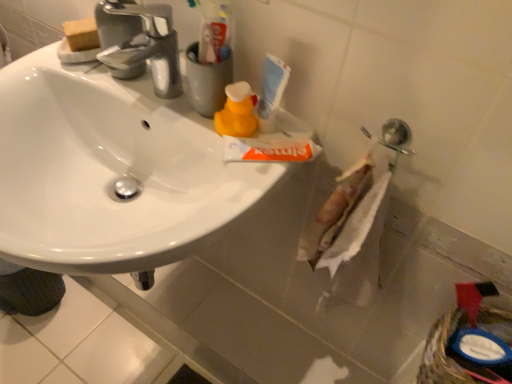
Question: Does blue plastic basket at lower right touch yellow matte bottle at center?

Choices:
 (A) yes
 (B) no

Answer: (B)

Question: Does blue plastic basket at lower right have a greater height compared to yellow matte bottle at center?

Choices:
 (A) no
 (B) yes

Answer: (B)

Question: From a real-world perspective, does blue plastic basket at lower right stand above yellow matte bottle at center?

Choices:
 (A) no
 (B) yes

Answer: (A)

Question: Is blue plastic basket at lower right not inside yellow matte bottle at center?

Choices:
 (A) yes
 (B) no

Answer: (A)

Question: Considering the relative sizes of blue plastic basket at lower right and yellow matte bottle at center in the image provided, is blue plastic basket at lower right wider than yellow matte bottle at center?

Choices:
 (A) yes
 (B) no

Answer: (A)

Question: Is yellow matte bottle at center at the back of blue plastic basket at lower right?

Choices:
 (A) no
 (B) yes

Answer: (A)

Question: From the image's perspective, is chrome metallic faucet at upper left on top of yellow matte bottle at center?

Choices:
 (A) yes
 (B) no

Answer: (A)

Question: Is the depth of chrome metallic faucet at upper left less than that of yellow matte bottle at center?

Choices:
 (A) no
 (B) yes

Answer: (B)

Question: Is the depth of chrome metallic faucet at upper left greater than that of yellow matte bottle at center?

Choices:
 (A) no
 (B) yes

Answer: (A)

Question: Considering the relative sizes of chrome metallic faucet at upper left and yellow matte bottle at center in the image provided, is chrome metallic faucet at upper left thinner than yellow matte bottle at center?

Choices:
 (A) no
 (B) yes

Answer: (A)

Question: From a real-world perspective, is chrome metallic faucet at upper left physically above yellow matte bottle at center?

Choices:
 (A) no
 (B) yes

Answer: (B)

Question: Is chrome metallic faucet at upper left taller than yellow matte bottle at center?

Choices:
 (A) yes
 (B) no

Answer: (A)

Question: Is yellow matte bottle at center facing towards blue plastic basket at lower right?

Choices:
 (A) yes
 (B) no

Answer: (B)